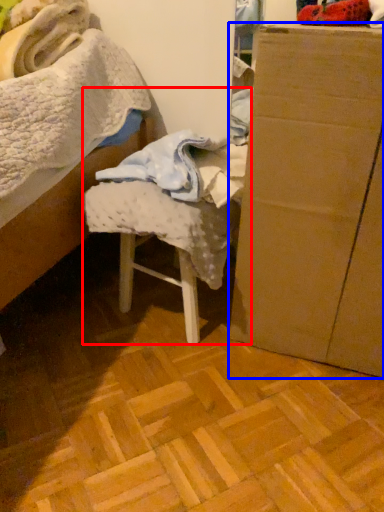
Question: Which of the following is the farthest to the observer, chair (highlighted by a red box) or furniture (highlighted by a blue box)?

Choices:
 (A) chair
 (B) furniture

Answer: (A)